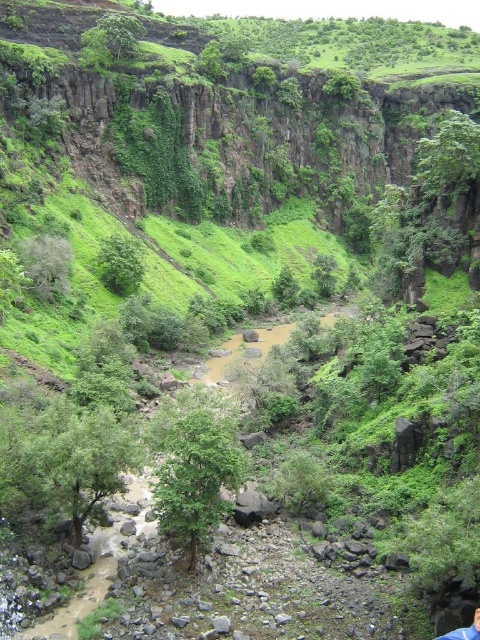
Question: Can you confirm if green leafy tree at center is wider than green leafy bush at center?

Choices:
 (A) yes
 (B) no

Answer: (A)

Question: Which point appears closest to the camera in this image?

Choices:
 (A) (240, 456)
 (B) (97, 273)

Answer: (A)

Question: Can you confirm if green leafy tree at center is bigger than green leafy bush at center?

Choices:
 (A) yes
 (B) no

Answer: (A)

Question: Among these points, which one is farthest from the camera?

Choices:
 (A) coord(140,266)
 (B) coord(191,483)

Answer: (A)

Question: From the image, what is the correct spatial relationship of green leafy tree at center in relation to green leafy bush at center?

Choices:
 (A) below
 (B) above

Answer: (A)

Question: Which point is closer to the camera taking this photo?

Choices:
 (A) (182, 465)
 (B) (132, 289)

Answer: (A)